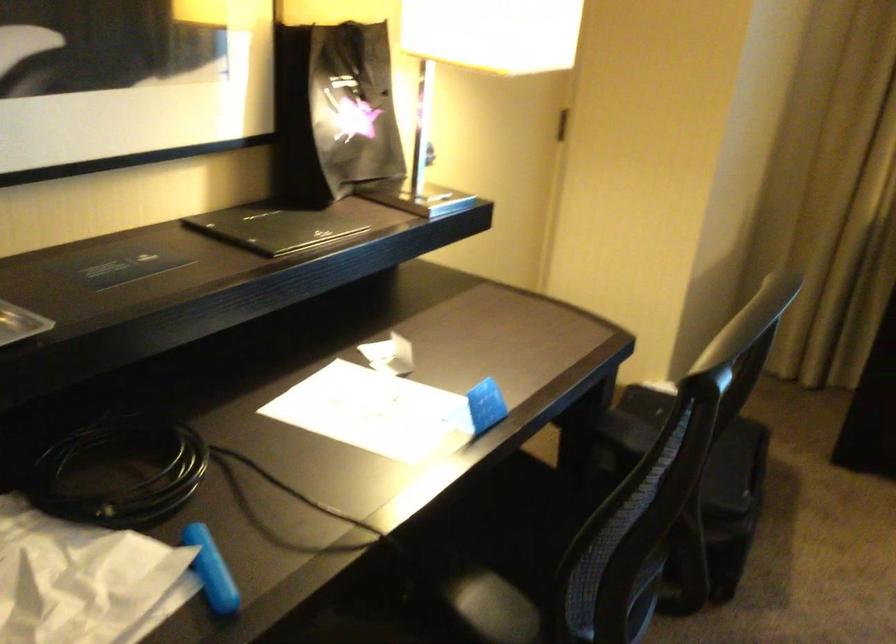
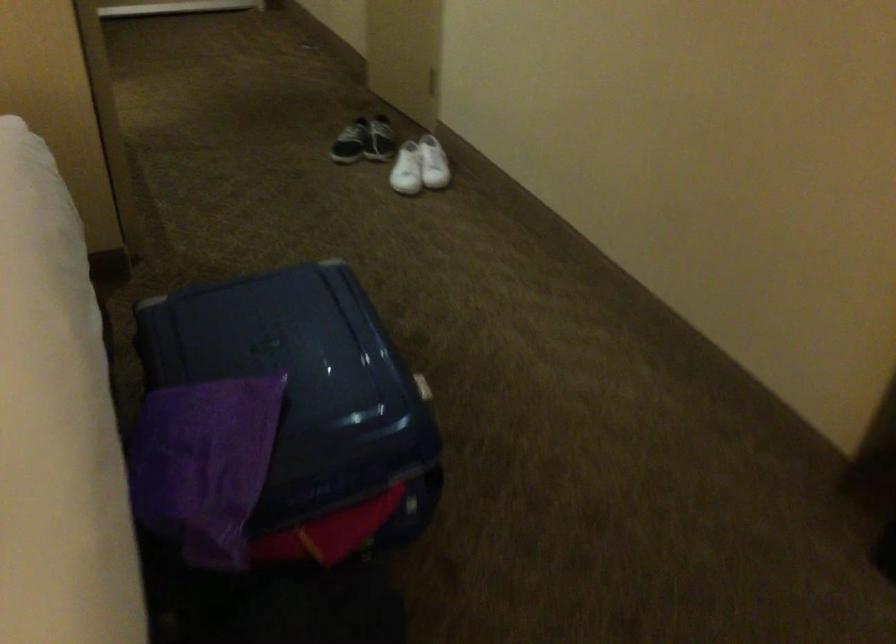
First-person continuous shooting, in which direction is the camera rotating?

The camera rotated toward left-down.